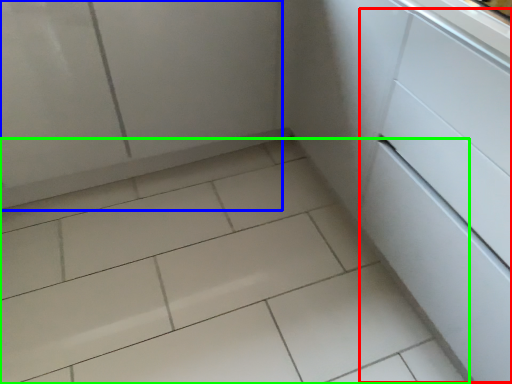
Question: Which is farther away from drawer (highlighted by a red box)? screen door (highlighted by a blue box) or ceramic tile (highlighted by a green box)?

Choices:
 (A) screen door
 (B) ceramic tile

Answer: (A)